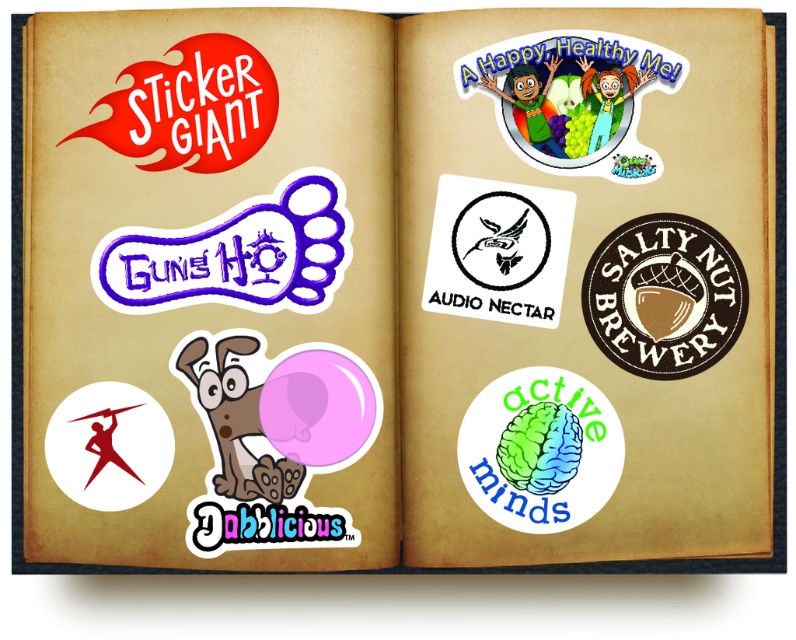
Question: Which object is positioned closest to the brown textured patch at upper right?

Choices:
 (A) purple glossy foot at center-left
 (B) white matte sticker at center
 (C) matte plastic sticker at upper center
 (D) rainbow matte brain at center

Answer: (B)

Question: Is matte plastic sticker at upper center closer to camera compared to white matte sticker at center?

Choices:
 (A) no
 (B) yes

Answer: (B)

Question: Which point appears closest to the camera in this image?

Choices:
 (A) (267, 96)
 (B) (650, 376)
 (C) (570, 97)
 (D) (432, 257)

Answer: (A)

Question: Which point appears closest to the camera in this image?

Choices:
 (A) (160, 300)
 (B) (739, 272)
 (C) (537, 61)
 (D) (539, 218)

Answer: (C)

Question: Does matte plastic sticker at upper center have a greater width compared to rainbow matte brain at center?

Choices:
 (A) no
 (B) yes

Answer: (B)

Question: Is the position of rainbow matte brain at center more distant than that of brown textured patch at upper right?

Choices:
 (A) yes
 (B) no

Answer: (B)